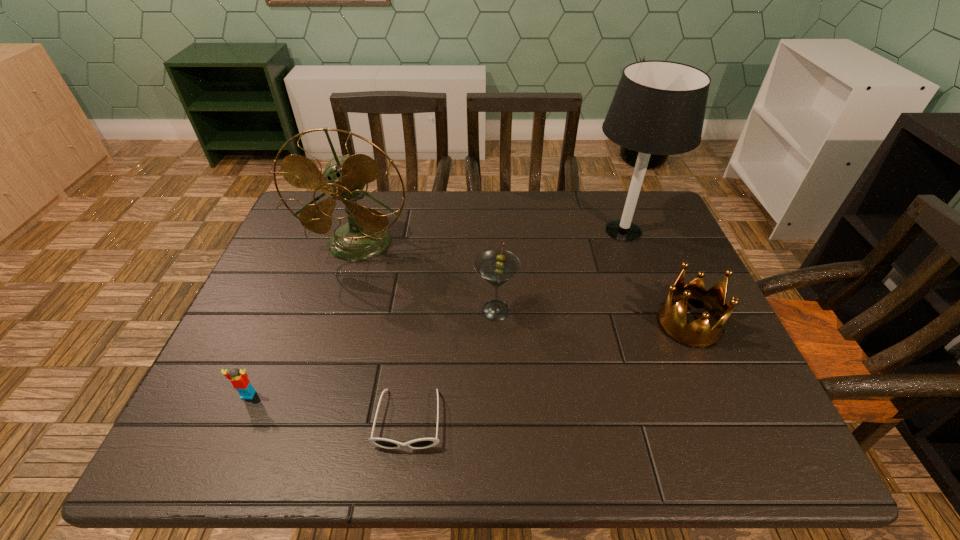
Where is `free space located 0.100m on the front of the crown`? The width and height of the screenshot is (960, 540). free space located 0.100m on the front of the crown is located at coordinates (718, 388).

The width and height of the screenshot is (960, 540). I want to click on free region located 0.100m on the face of the second shortest object, so click(227, 448).

Locate an element on the screen. Image resolution: width=960 pixels, height=540 pixels. table lamp that is at the far edge is located at coordinates (658, 108).

The height and width of the screenshot is (540, 960). What are the coordinates of `fan that is at the far edge` in the screenshot? It's located at (366, 235).

Where is `object located in the near edge section of the desktop`? This screenshot has height=540, width=960. object located in the near edge section of the desktop is located at coordinates tap(422, 443).

The width and height of the screenshot is (960, 540). What are the coordinates of `fan present at the left edge` in the screenshot? It's located at (366, 235).

At what (x,y) coordinates should I click in order to perform the action: click on Lego that is at the left edge. Please return your answer as a coordinate pair (x, y). Looking at the image, I should click on (239, 379).

The width and height of the screenshot is (960, 540). In order to click on table lamp at the right edge in this screenshot , I will do `click(658, 108)`.

This screenshot has height=540, width=960. In order to click on crown that is at the right edge in this screenshot , I will do `click(698, 334)`.

This screenshot has height=540, width=960. I want to click on object that is at the far left corner, so click(366, 235).